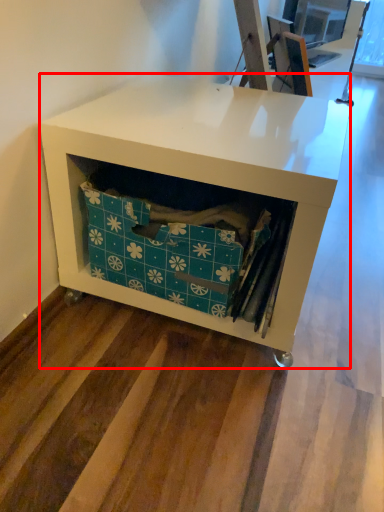
Question: Considering the relative positions of desk (annotated by the red box) and storage box in the image provided, where is desk (annotated by the red box) located with respect to the staircase?

Choices:
 (A) left
 (B) right

Answer: (B)